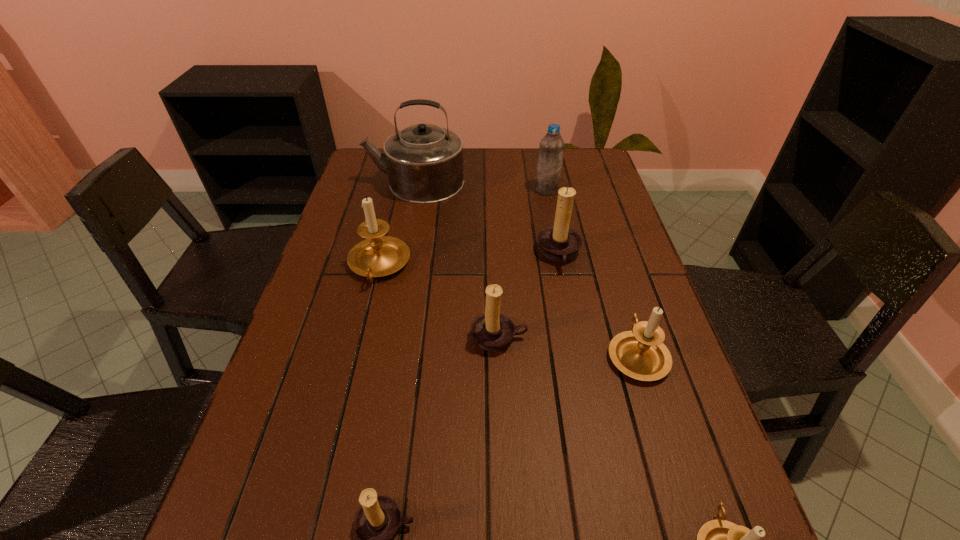
Where is `free space between the farthest beige candle holder and the tallest object`? The width and height of the screenshot is (960, 540). free space between the farthest beige candle holder and the tallest object is located at coordinates (397, 224).

I want to click on vacant area that lies between the water bottle and the tallest object, so click(481, 186).

I want to click on vacant space that's between the leftmost beige candle holder and the second biggest beige candle holder, so click(x=508, y=310).

Find the location of a particular element. This screenshot has height=540, width=960. free space that is in between the second farthest beige candle holder and the fourth object from left to right is located at coordinates (567, 346).

This screenshot has width=960, height=540. Find the location of `the fourth closest object to the gray kettle`. the fourth closest object to the gray kettle is located at coordinates (492, 330).

Identify which object is the nearest to the smallest beige candle holder. Please provide its 2D coordinates. Your answer should be formatted as a tuple, i.e. [(x, y)], where the tuple contains the x and y coordinates of a point satisfying the conditions above.

[(641, 354)]

This screenshot has width=960, height=540. Find the location of `the fifth closest candle holder to the tallest object`. the fifth closest candle holder to the tallest object is located at coordinates [377, 520].

Image resolution: width=960 pixels, height=540 pixels. I want to click on candle holder that is the nearest to the biggest beige candle holder, so click(492, 330).

Where is `the closest brown candle holder to the farthest brown candle holder`? the closest brown candle holder to the farthest brown candle holder is located at coordinates (492, 330).

Identify which brown candle holder is the nearest to the second farthest brown candle holder. Please provide its 2D coordinates. Your answer should be formatted as a tuple, i.e. [(x, y)], where the tuple contains the x and y coordinates of a point satisfying the conditions above.

[(558, 242)]